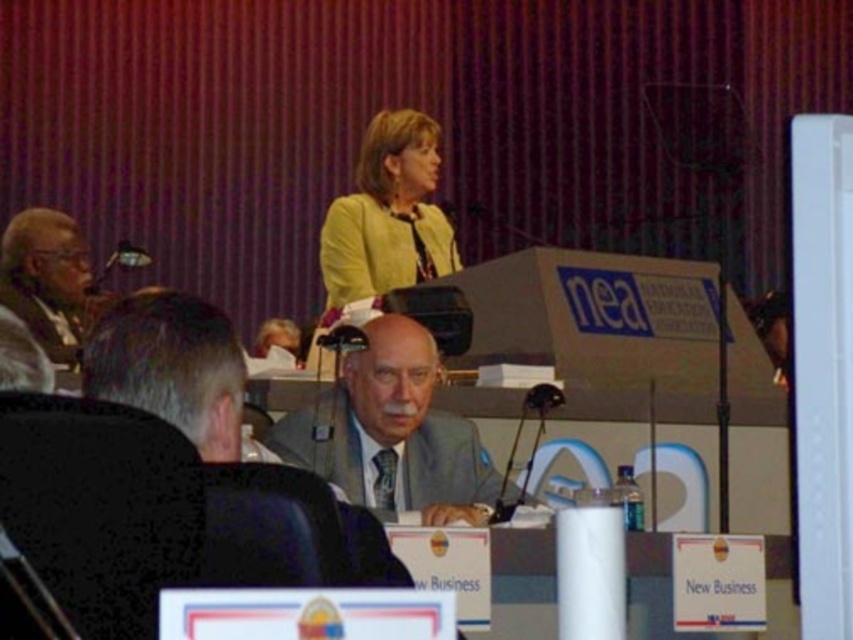
Question: Does gray suit at center have a smaller size compared to matte yellow jacket at center?

Choices:
 (A) yes
 (B) no

Answer: (A)

Question: Does gray suit at center appear under matte black microphone at left?

Choices:
 (A) yes
 (B) no

Answer: (A)

Question: Which object appears closest to the camera in this image?

Choices:
 (A) matte black microphone at left
 (B) matte yellow jacket at center
 (C) gray suit at center

Answer: (C)

Question: Is matte yellow jacket at center closer to camera compared to matte black microphone at left?

Choices:
 (A) no
 (B) yes

Answer: (A)

Question: Which object is the farthest from the matte yellow jacket at center?

Choices:
 (A) gray suit at center
 (B) matte black microphone at left

Answer: (A)

Question: Which object appears farthest from the camera in this image?

Choices:
 (A) matte yellow jacket at center
 (B) matte black microphone at left
 (C) gray suit at center

Answer: (A)